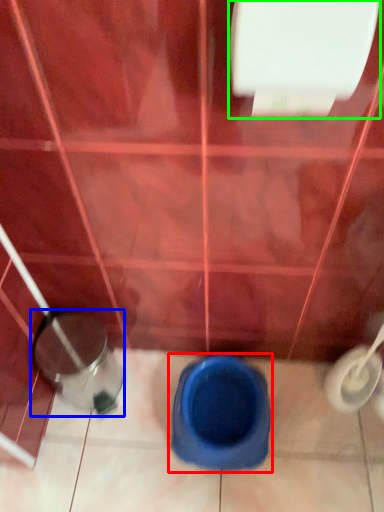
Question: Which is nearer to the toilet (highlighted by a red box)? potty (highlighted by a blue box) or toilet paper (highlighted by a green box).

Choices:
 (A) potty
 (B) toilet paper

Answer: (A)